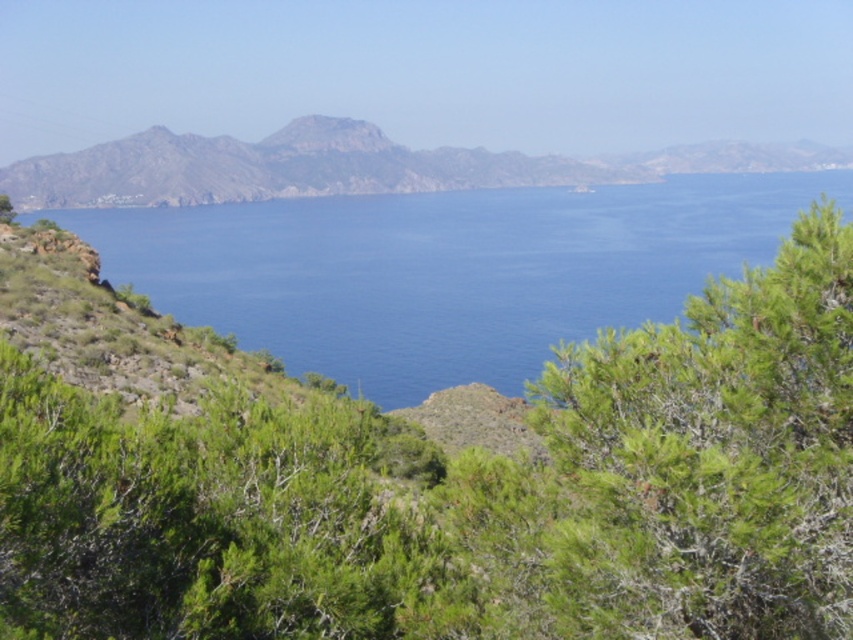
Question: Which object is farther from the camera taking this photo?

Choices:
 (A) green leafy shrub at right
 (B) blue water at center
 (C) green leafy shrubs at center

Answer: (B)

Question: In this image, where is green leafy shrub at right located relative to rugged brown mountain at center?

Choices:
 (A) above
 (B) below

Answer: (B)

Question: Does green leafy shrubs at center appear under blue water at center?

Choices:
 (A) yes
 (B) no

Answer: (A)

Question: Which point appears closest to the camera in this image?

Choices:
 (A) (386, 538)
 (B) (44, 170)
 (C) (369, 230)
 (D) (566, 579)

Answer: (D)

Question: Can you confirm if green leafy shrubs at center is wider than rugged brown mountain at center?

Choices:
 (A) no
 (B) yes

Answer: (A)

Question: Among these points, which one is nearest to the camera?

Choices:
 (A) (231, 416)
 (B) (747, 188)
 (C) (585, 365)
 (D) (303, 120)

Answer: (C)